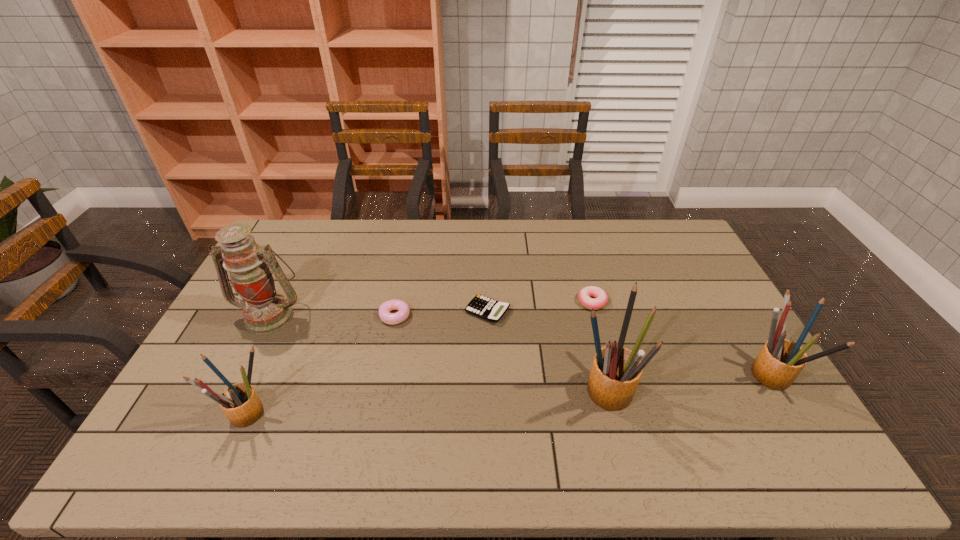
Where is `the shortest pencil box`? the shortest pencil box is located at coordinates (240, 403).

The height and width of the screenshot is (540, 960). What are the coordinates of `the fourth shortest object` in the screenshot? It's located at (240, 403).

Identify the location of the tallest pencil box. (616, 371).

Locate an element on the screen. The image size is (960, 540). the second tallest pencil box is located at coordinates (780, 361).

Locate an element on the screen. the fifth shortest object is located at coordinates (780, 361).

What are the coordinates of `oil lamp` in the screenshot? It's located at (265, 311).

Image resolution: width=960 pixels, height=540 pixels. What are the coordinates of `the left doughnut` in the screenshot? It's located at (403, 309).

This screenshot has height=540, width=960. I want to click on the fourth object from right to left, so 481,306.

Where is `calculator`? The width and height of the screenshot is (960, 540). calculator is located at coordinates (481, 306).

This screenshot has height=540, width=960. Find the location of `the right doughnut`. the right doughnut is located at coordinates (601, 298).